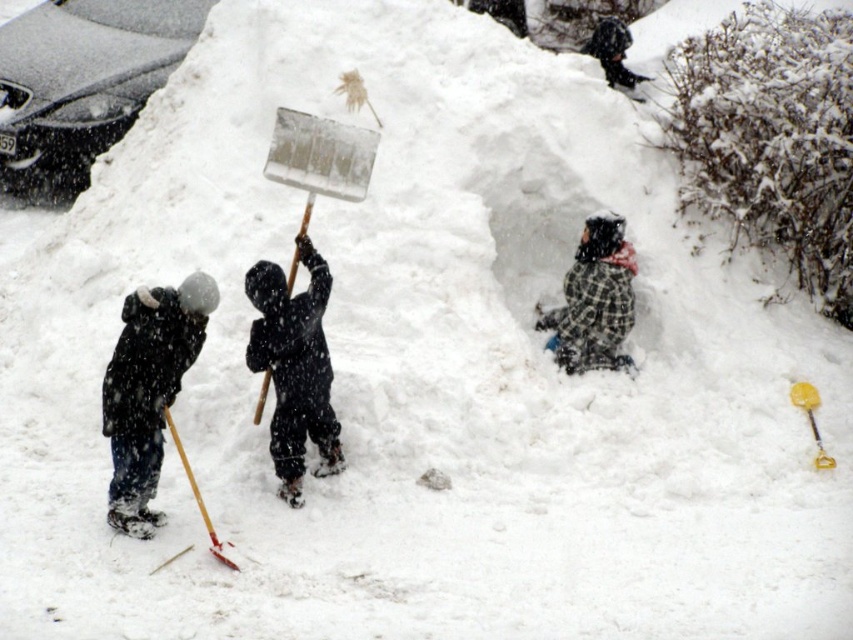
From the picture: You are a parent supervising two children shoveling snow. One child is wearing a black matte snowsuit at left, and the other has a plaid fabric at center. Which child is closer to you?

The black matte snowsuit at left is closer to you because it is in front of the plaid fabric at center.

You are standing in the snowy scene and want to pick up the black matte snow shovel at center to help with snow removal. Considering the distance, is the shovel within an easy reach of 5 meters or closer?

The black matte snow shovel at center is 7.93 meters away from viewer, which is beyond the 5 meters easy reach distance. You would need to walk closer to reach it.

You are a parent supervising two children shoveling snow. You notice the black matte snow shovel at center and the wooden shovel at lower left. Which shovel is positioned higher up in the image?

The black matte snow shovel at center is located above the wooden shovel at lower left, so it is positioned higher up in the image.